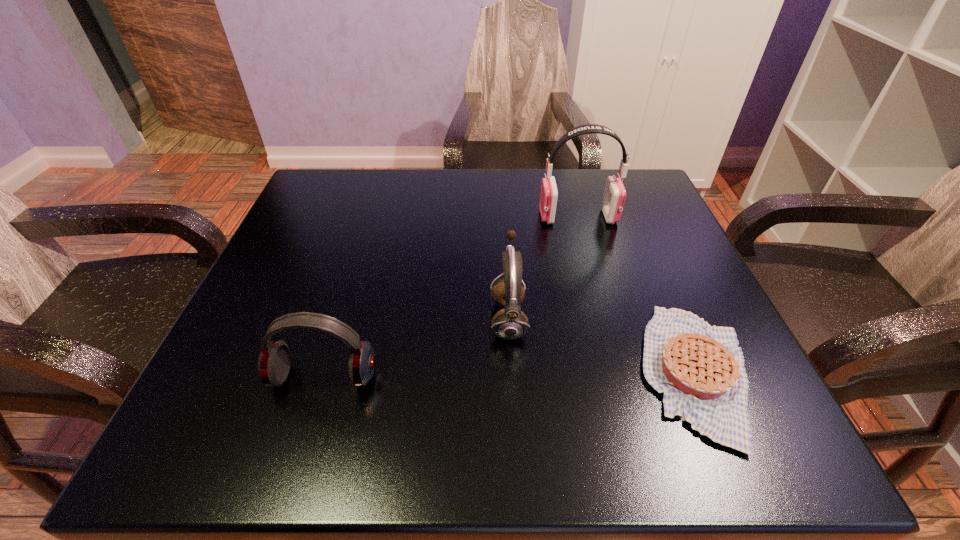
Identify which object is the nearest to the nearest earphone. Please provide its 2D coordinates. Your answer should be formatted as a tuple, i.e. [(x, y)], where the tuple contains the x and y coordinates of a point satisfying the conditions above.

[(510, 323)]

Identify the location of the closest earphone to the second shortest earphone. Image resolution: width=960 pixels, height=540 pixels. (273, 365).

Identify which earphone is the nearest to the farthest object. Please provide its 2D coordinates. Your answer should be formatted as a tuple, i.e. [(x, y)], where the tuple contains the x and y coordinates of a point satisfying the conditions above.

[(510, 323)]

Locate an element on the screen. free spot that satisfies the following two spatial constraints: 1. on the ear pads of the second object from left to right; 2. on the back side of the shortest object is located at coordinates (512, 373).

Find the location of a particular element. This screenshot has height=540, width=960. blank area in the image that satisfies the following two spatial constraints: 1. on the ear pads of the second nearest earphone; 2. on the ear cups of the leftmost object is located at coordinates (512, 377).

Where is `free space that satisfies the following two spatial constraints: 1. on the outer surface of the tallest object; 2. on the ear cups of the leftmost earphone`? The image size is (960, 540). free space that satisfies the following two spatial constraints: 1. on the outer surface of the tallest object; 2. on the ear cups of the leftmost earphone is located at coordinates (622, 377).

The width and height of the screenshot is (960, 540). What are the coordinates of `free space that satisfies the following two spatial constraints: 1. on the ear pads of the second earphone from right to left; 2. on the back side of the pie` in the screenshot? It's located at (512, 373).

The image size is (960, 540). Identify the location of free point that satisfies the following two spatial constraints: 1. on the outer surface of the farthest earphone; 2. on the ear cups of the shortest earphone. (622, 377).

What are the coordinates of `free space that satisfies the following two spatial constraints: 1. on the outer surface of the rightmost earphone; 2. on the right side of the shortest object` in the screenshot? It's located at (621, 373).

Where is `vacant area in the image that satisfies the following two spatial constraints: 1. on the outer surface of the tallest object; 2. on the left side of the shortest object`? This screenshot has width=960, height=540. vacant area in the image that satisfies the following two spatial constraints: 1. on the outer surface of the tallest object; 2. on the left side of the shortest object is located at coordinates (621, 373).